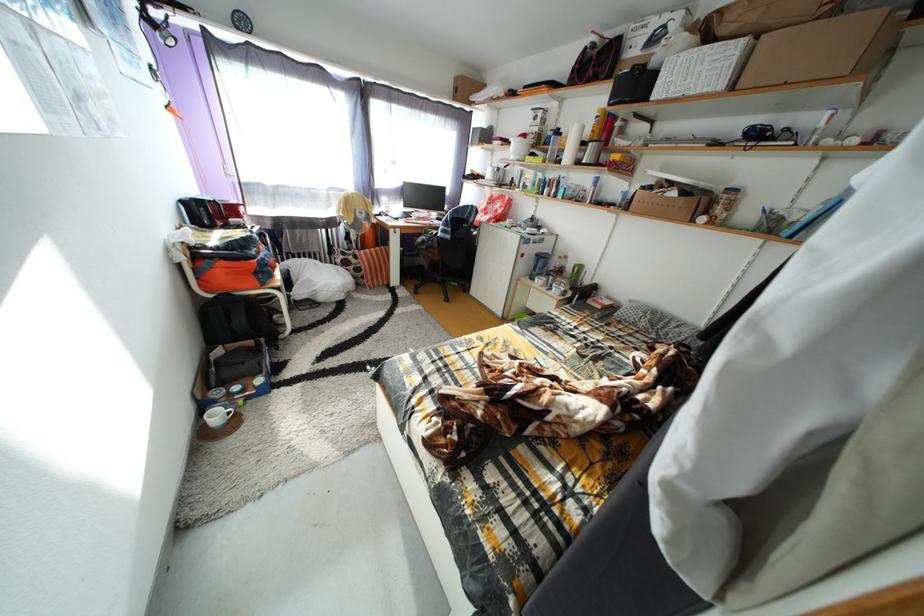
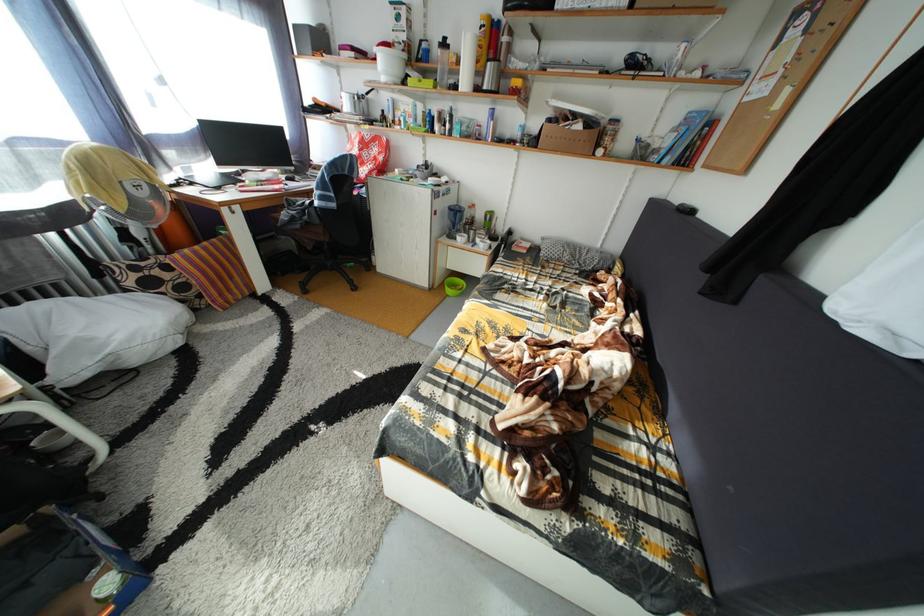
Question: The first image is from the beginning of the video and the second image is from the end. How did the camera likely rotate when shooting the video?

Choices:
 (A) Left
 (B) Right
 (C) Up
 (D) Down

Answer: (B)